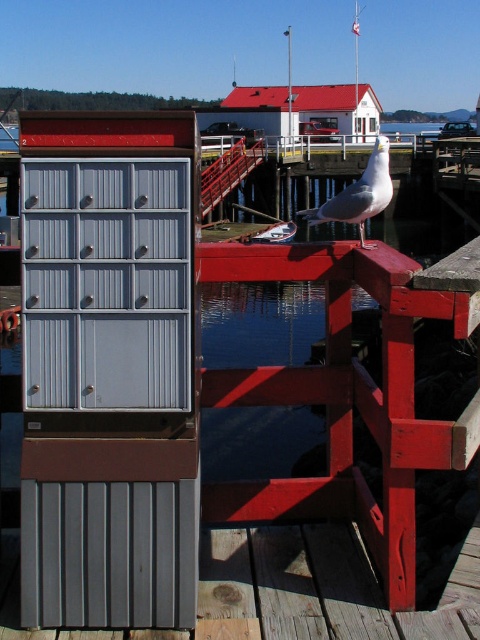
You are organizing a storage area and need to place a heavy item on the lower shelf. You see the matte gray drawers at center and the gray plastic drawers at center. Which drawers should you place the item on to ensure it is on the lower shelf?

The matte gray drawers at center are located below the gray plastic drawers at center, so placing the heavy item on the matte gray drawers at center ensures it is on the lower shelf.

You are organizing a small storage area and have two drawers available. The matte gray drawers at center and the gray plastic drawers at center. Which drawer should you choose if you need more storage space?

The matte gray drawers at center is larger in size than the gray plastic drawers at center, so you should choose the matte gray drawers at center for more storage space.